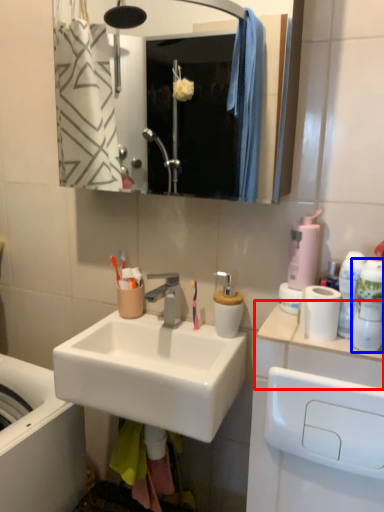
Question: Which point is closer to the camera, counter top (highlighted by a red box) or mouthwash (highlighted by a blue box)?

Choices:
 (A) counter top
 (B) mouthwash

Answer: (A)